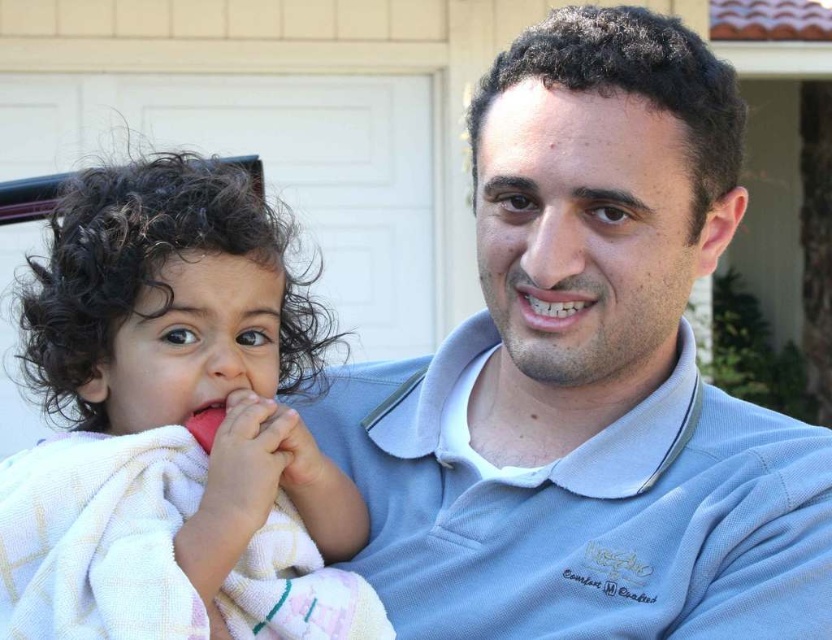
What object is located at the coordinates point (583, 509) in the image?

The point (583, 509) corresponds to the light blue cotton polo shirt at center.